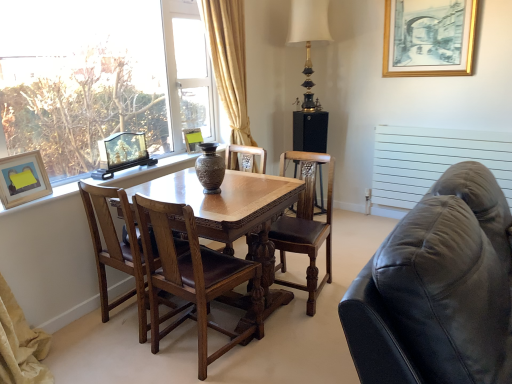
This screenshot has width=512, height=384. I want to click on space that is in front of brown leather chair at center, which appears as the first chair when viewed from the left, so click(118, 356).